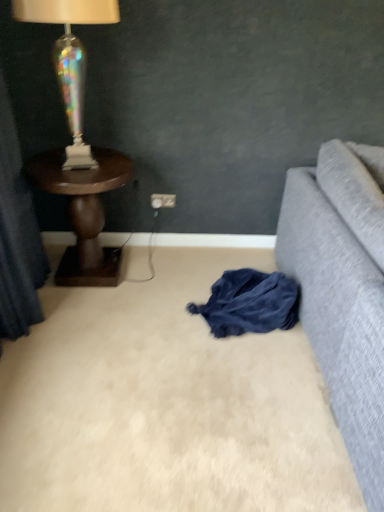
This screenshot has width=384, height=512. I want to click on vacant region below iridescent glass lamp at upper left (from a real-world perspective), so click(77, 168).